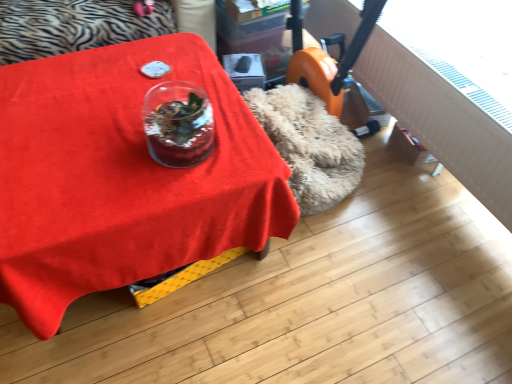
Question: From their relative heights in the image, would you say matte red tablecloth at center is taller or shorter than transparent glass vase at center?

Choices:
 (A) short
 (B) tall

Answer: (B)

Question: Considering the positions of matte red tablecloth at center and transparent glass vase at center in the image, is matte red tablecloth at center wider or thinner than transparent glass vase at center?

Choices:
 (A) thin
 (B) wide

Answer: (B)

Question: From a real-world perspective, is matte red tablecloth at center above or below transparent glass vase at center?

Choices:
 (A) above
 (B) below

Answer: (B)

Question: From the image's perspective, is transparent glass vase at center located above or below matte red tablecloth at center?

Choices:
 (A) above
 (B) below

Answer: (A)

Question: Is transparent glass vase at center in front of or behind matte red tablecloth at center in the image?

Choices:
 (A) front
 (B) behind

Answer: (B)

Question: Would you say transparent glass vase at center is to the left or to the right of matte red tablecloth at center in the picture?

Choices:
 (A) right
 (B) left

Answer: (A)

Question: Is transparent glass vase at center taller or shorter than matte red tablecloth at center?

Choices:
 (A) tall
 (B) short

Answer: (B)